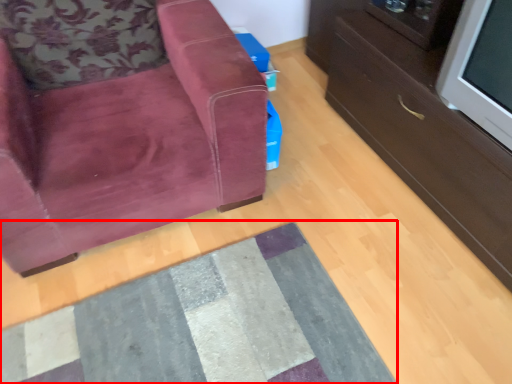
Question: From the image's perspective, where is mat (annotated by the red box) located in relation to chair in the image?

Choices:
 (A) below
 (B) above

Answer: (A)